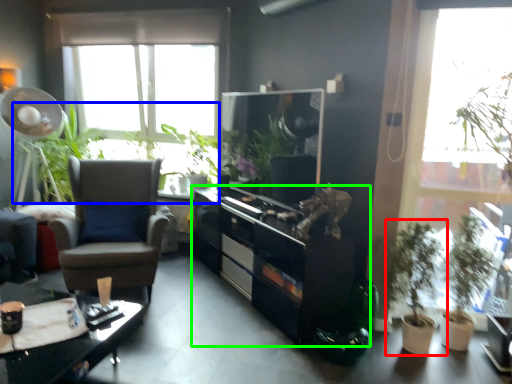
Question: Estimate the real-world distances between objects in this image. Which object is closer to houseplant (highlighted by a red box), vegetation (highlighted by a blue box) or cabinetry (highlighted by a green box)?

Choices:
 (A) vegetation
 (B) cabinetry

Answer: (B)